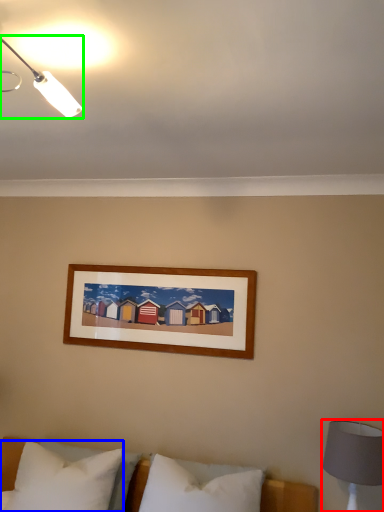
Question: Which is nearer to the bedside lamp (highlighted by a red box)? pillow (highlighted by a blue box) or lamp (highlighted by a green box).

Choices:
 (A) pillow
 (B) lamp

Answer: (A)